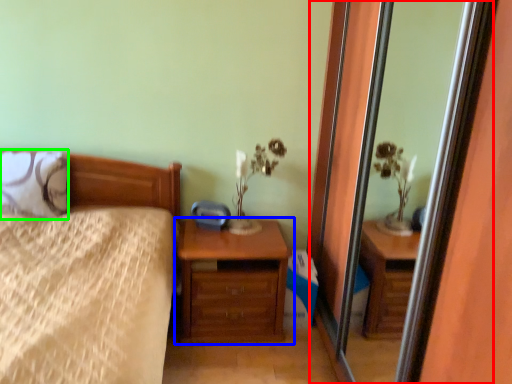
Question: Which object is the farthest from screen door (highlighted by a red box)? Choose among these: chest of drawers (highlighted by a blue box) or pillow (highlighted by a green box).

Choices:
 (A) chest of drawers
 (B) pillow

Answer: (B)